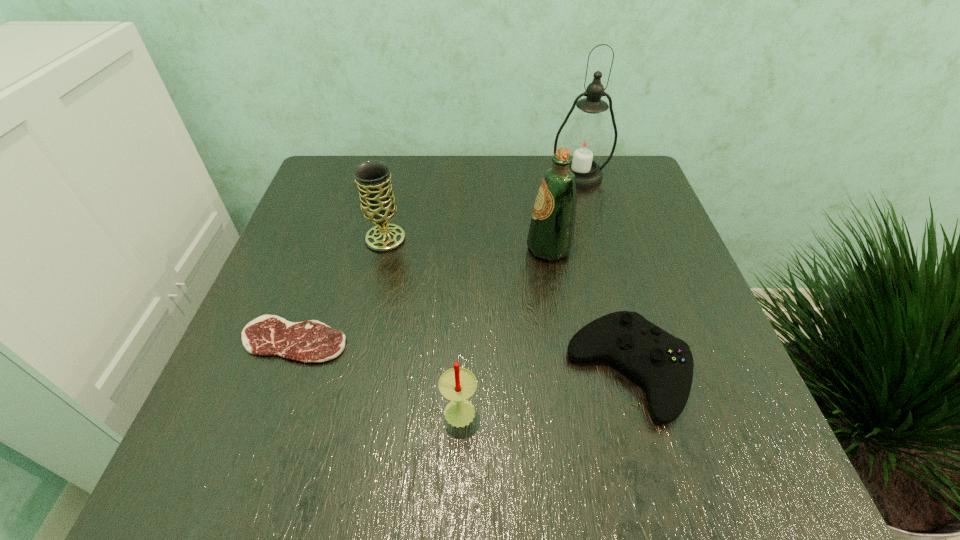
In order to click on the farthest object in this screenshot , I will do `click(586, 139)`.

The image size is (960, 540). I want to click on the tallest object, so click(x=586, y=139).

Image resolution: width=960 pixels, height=540 pixels. I want to click on the second tallest object, so click(551, 233).

Where is `the fourth shortest object`? the fourth shortest object is located at coordinates (372, 177).

Find the location of a particular element. Image resolution: width=960 pixels, height=540 pixels. the fourth tallest object is located at coordinates (457, 384).

At what (x,y) coordinates should I click in order to perform the action: click on the fourth object from right to left. Please return your answer as a coordinate pair (x, y). This screenshot has width=960, height=540. Looking at the image, I should click on (457, 384).

Image resolution: width=960 pixels, height=540 pixels. In order to click on the fifth tallest object in this screenshot , I will do `click(663, 363)`.

Where is `the shortest object`? The width and height of the screenshot is (960, 540). the shortest object is located at coordinates (309, 341).

Find the location of a particular element. The image size is (960, 540). free space located on the left of the farthest object is located at coordinates (469, 177).

The image size is (960, 540). What are the coordinates of `free space located 0.390m on the front-facing side of the second tallest object` in the screenshot? It's located at (348, 248).